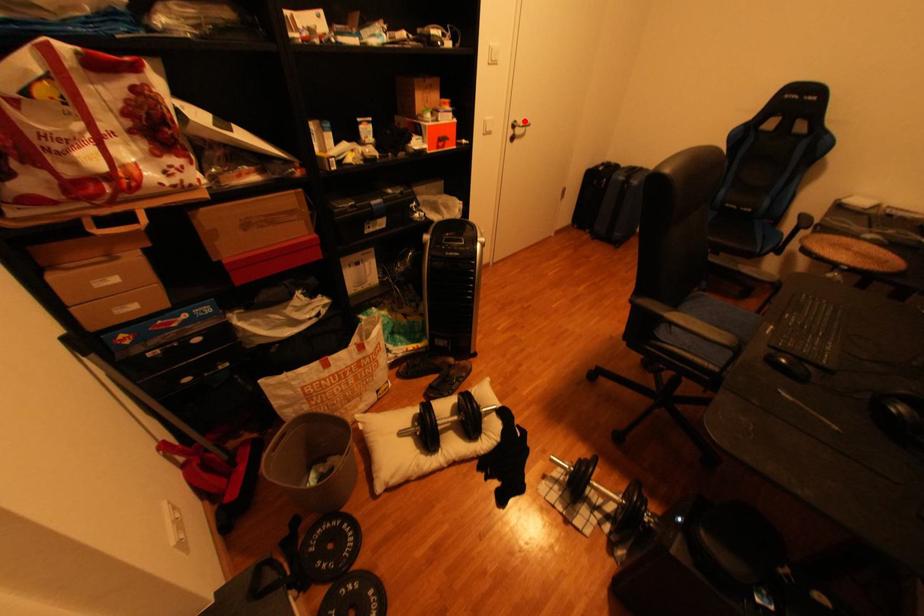
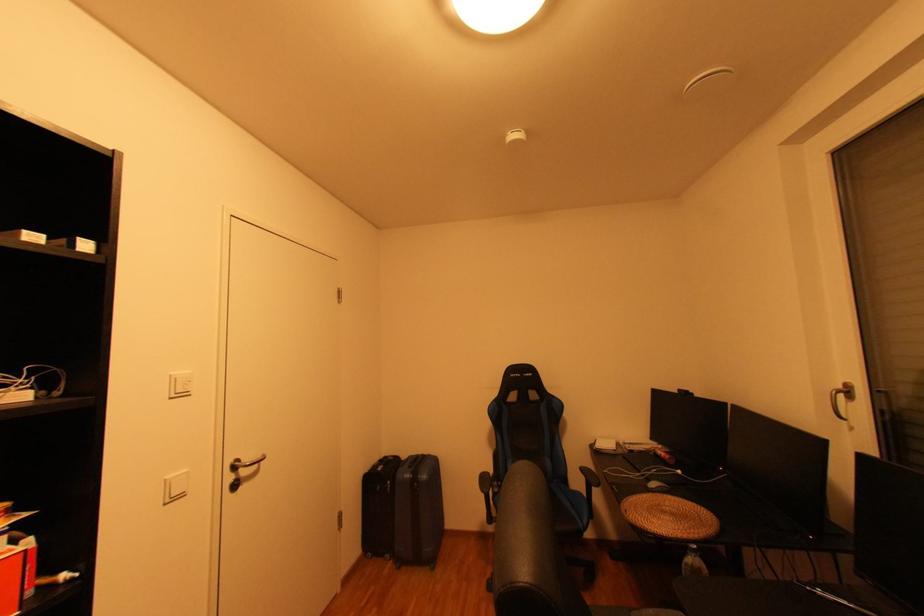
Question: I am providing you with two images of the same scene from different viewpoints. In image1, a red point is highlighted. Considering the same 3D point in image2, which of the following is correct?

Choices:
 (A) It is closer
 (B) It is farther

Answer: (B)